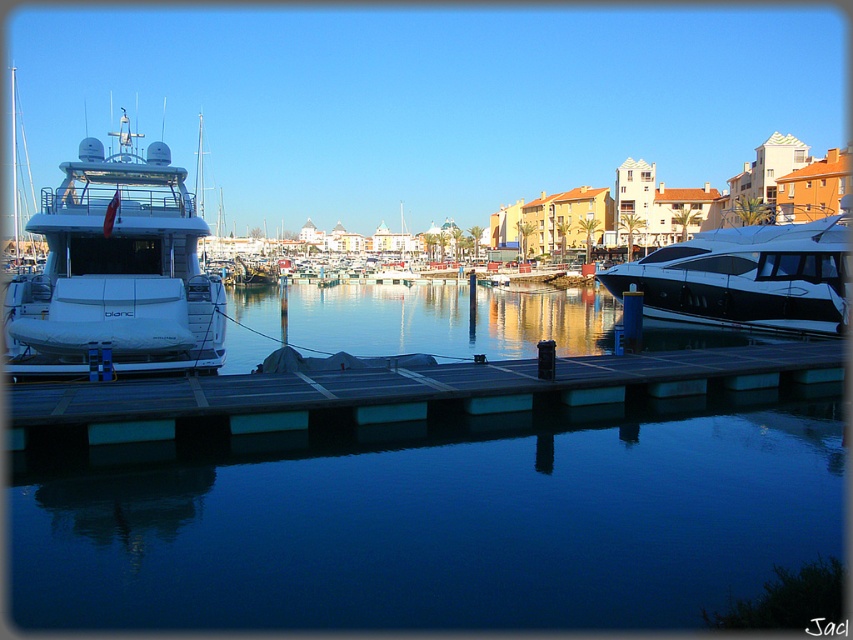
Which is in front, point (221, 324) or point (817, 276)?

Point (221, 324)

From the picture: Can you confirm if white glossy yacht at left is wider than white glossy yacht at right?

Correct, the width of white glossy yacht at left exceeds that of white glossy yacht at right.

Describe the element at coordinates (115, 273) in the screenshot. I see `white glossy yacht at left` at that location.

The width and height of the screenshot is (853, 640). Identify the location of white glossy yacht at left. [115, 273].

Does clear glass water at center appear under white glossy yacht at right?

Indeed, clear glass water at center is positioned under white glossy yacht at right.

Looking at this image, can you confirm if clear glass water at center is shorter than white glossy yacht at right?

Yes.

Where is `clear glass water at center`? clear glass water at center is located at coordinates (416, 321).

Image resolution: width=853 pixels, height=640 pixels. I want to click on clear glass water at center, so click(416, 321).

Is transparent glass water at center to the left of clear glass water at center from the viewer's perspective?

Incorrect, transparent glass water at center is not on the left side of clear glass water at center.

Which is more to the right, transparent glass water at center or clear glass water at center?

transparent glass water at center

Where is `transparent glass water at center`? The width and height of the screenshot is (853, 640). transparent glass water at center is located at coordinates (439, 529).

At what (x,y) coordinates should I click in order to perform the action: click on transparent glass water at center. Please return your answer as a coordinate pair (x, y). Looking at the image, I should click on (439, 529).